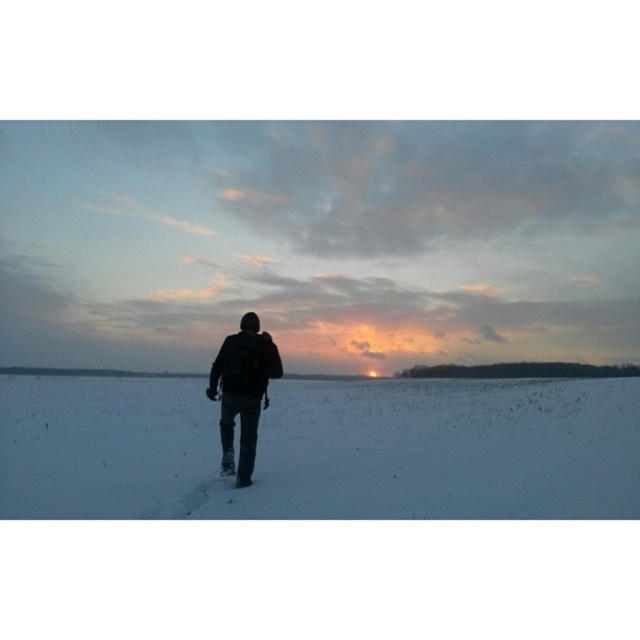
Question: Which of the following is the closest to the observer?

Choices:
 (A) white powdery snow at center
 (B) black matte backpack at center

Answer: (A)

Question: In this image, where is black matte snowshoe at center located relative to white powdery snow at center?

Choices:
 (A) left
 (B) right

Answer: (A)

Question: Is the position of black matte snowshoe at center more distant than that of white powdery snow at center?

Choices:
 (A) yes
 (B) no

Answer: (A)

Question: Based on their relative distances, which object is farther from the black matte backpack at center?

Choices:
 (A) black matte snowshoe at center
 (B) white powdery snow at center

Answer: (A)

Question: Which object is closer to the camera taking this photo?

Choices:
 (A) white powdery snow at center
 (B) black matte backpack at center
 (C) black matte snowshoe at center

Answer: (A)

Question: Considering the relative positions of black matte snowshoe at center and white powdery snow at center in the image provided, where is black matte snowshoe at center located with respect to white powdery snow at center?

Choices:
 (A) right
 (B) left

Answer: (B)